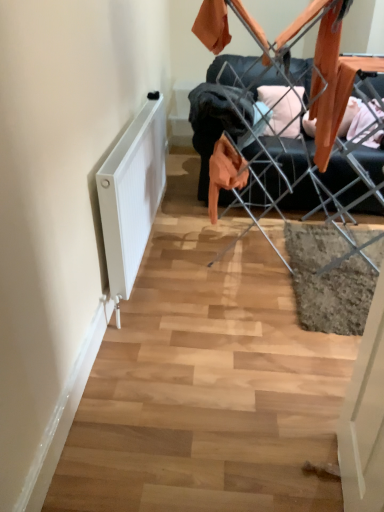
The height and width of the screenshot is (512, 384). What do you see at coordinates (282, 184) in the screenshot?
I see `metal wire laundry rack at center` at bounding box center [282, 184].

Where is `metal wire laundry rack at center`? Image resolution: width=384 pixels, height=512 pixels. metal wire laundry rack at center is located at coordinates (282, 184).

In order to face metal wire laundry rack at center, should I rotate leftwards or rightwards?

Rotate your view right by about 14.037°.

At what (x,y) coordinates should I click in order to perform the action: click on white matte radiator at lower left. Please return your answer as a coordinate pair (x, y). Image resolution: width=384 pixels, height=512 pixels. Looking at the image, I should click on point(132,196).

Image resolution: width=384 pixels, height=512 pixels. Describe the element at coordinates (132, 196) in the screenshot. I see `white matte radiator at lower left` at that location.

At what (x,y) coordinates should I click in order to perform the action: click on metal wire laundry rack at center. Please return your answer as a coordinate pair (x, y). The width and height of the screenshot is (384, 512). Looking at the image, I should click on (282, 184).

Between metal wire laundry rack at center and white matte radiator at lower left, which one appears on the left side from the viewer's perspective?

white matte radiator at lower left.

Which is behind, metal wire laundry rack at center or white matte radiator at lower left?

metal wire laundry rack at center.

Considering the points (382, 160) and (127, 162), which point is in front, point (382, 160) or point (127, 162)?

The point (127, 162) is in front.

From the image's perspective, is metal wire laundry rack at center above or below white matte radiator at lower left?

From the image's perspective, metal wire laundry rack at center appears above white matte radiator at lower left.

From a real-world perspective, is metal wire laundry rack at center positioned above or below white matte radiator at lower left?

From a real-world perspective, metal wire laundry rack at center is physically above white matte radiator at lower left.

Considering the sizes of objects metal wire laundry rack at center and white matte radiator at lower left in the image provided, who is thinner, metal wire laundry rack at center or white matte radiator at lower left?

white matte radiator at lower left is thinner.

From the picture: Which of these two, metal wire laundry rack at center or white matte radiator at lower left, stands taller?

metal wire laundry rack at center.

Considering the sizes of objects metal wire laundry rack at center and white matte radiator at lower left in the image provided, who is smaller, metal wire laundry rack at center or white matte radiator at lower left?

white matte radiator at lower left.

Is metal wire laundry rack at center situated inside white matte radiator at lower left or outside?

The correct answer is: outside.

Based on the photo, would you say metal wire laundry rack at center is a long distance from white matte radiator at lower left?

metal wire laundry rack at center is near white matte radiator at lower left, not far away.

Is metal wire laundry rack at center looking in the opposite direction of white matte radiator at lower left?

metal wire laundry rack at center does not have its back to white matte radiator at lower left.

Can you tell me how much metal wire laundry rack at center and white matte radiator at lower left differ in facing direction?

There is a 92.3-degree angle between the facing directions of metal wire laundry rack at center and white matte radiator at lower left.

Measure the distance from metal wire laundry rack at center to white matte radiator at lower left.

A distance of 32.38 inches exists between metal wire laundry rack at center and white matte radiator at lower left.

Locate an element on the screen. The width and height of the screenshot is (384, 512). radiator that is on the left side of metal wire laundry rack at center is located at coordinates (132, 196).

Considering the relative positions of white matte radiator at lower left and metal wire laundry rack at center in the image provided, is white matte radiator at lower left to the left or to the right of metal wire laundry rack at center?

From the image, it's evident that white matte radiator at lower left is to the left of metal wire laundry rack at center.

Is white matte radiator at lower left in front of or behind metal wire laundry rack at center in the image?

white matte radiator at lower left is positioned closer to the viewer than metal wire laundry rack at center.

Is point (140, 204) farther from camera compared to point (371, 173)?

No, (140, 204) is closer to viewer.

From the image's perspective, is white matte radiator at lower left over metal wire laundry rack at center?

No.

Based on the photo, from a real-world perspective, between white matte radiator at lower left and metal wire laundry rack at center, who is vertically higher?

metal wire laundry rack at center is physically above.

Does white matte radiator at lower left have a greater width compared to metal wire laundry rack at center?

No.

Considering the relative sizes of white matte radiator at lower left and metal wire laundry rack at center in the image provided, is white matte radiator at lower left taller than metal wire laundry rack at center?

In fact, white matte radiator at lower left may be shorter than metal wire laundry rack at center.

Between white matte radiator at lower left and metal wire laundry rack at center, which one has smaller size?

Smaller between the two is white matte radiator at lower left.

Would you say metal wire laundry rack at center is part of white matte radiator at lower left's contents?

No, metal wire laundry rack at center is located outside of white matte radiator at lower left.

Is there a large distance between white matte radiator at lower left and metal wire laundry rack at center?

No, white matte radiator at lower left is not far away from metal wire laundry rack at center.

Is white matte radiator at lower left oriented towards metal wire laundry rack at center?

Yes, white matte radiator at lower left is aimed at metal wire laundry rack at center.

How distant is white matte radiator at lower left from metal wire laundry rack at center?

They are 32.38 inches apart.

Identify the location of furniture behind the white matte radiator at lower left. (282, 184).

At what (x,y) coordinates should I click in order to perform the action: click on furniture behind the white matte radiator at lower left. Please return your answer as a coordinate pair (x, y). The width and height of the screenshot is (384, 512). Looking at the image, I should click on (282, 184).

This screenshot has width=384, height=512. Identify the location of radiator in front of the metal wire laundry rack at center. (132, 196).